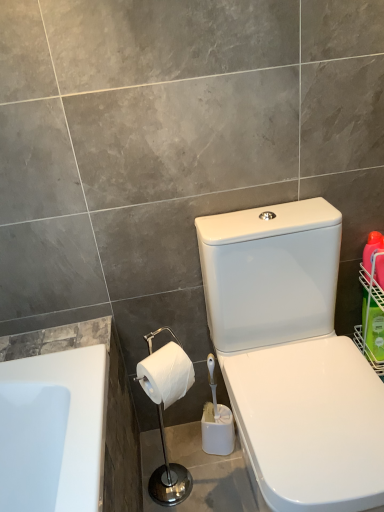
Image resolution: width=384 pixels, height=512 pixels. What are the coordinates of `white glossy toilet at center-right` in the screenshot? It's located at (292, 357).

The image size is (384, 512). Describe the element at coordinates (162, 411) in the screenshot. I see `white glossy toilet paper holder at lower left` at that location.

In order to face white glossy toilet paper holder at lower left, should I rotate leftwards or rightwards?

You should rotate left by 4.100 degrees.

Describe the element at coordinates (372, 249) in the screenshot. I see `bright orange plastic bottle at right` at that location.

Locate an element on the screen. This screenshot has height=512, width=384. white matte toilet paper at lower center is located at coordinates click(166, 374).

Considering the sizes of objects white glossy toilet at center-right and green plastic basket at right in the image provided, who is taller, white glossy toilet at center-right or green plastic basket at right?

white glossy toilet at center-right is taller.

Would you say white glossy toilet at center-right is outside green plastic basket at right?

Indeed, white glossy toilet at center-right is completely outside green plastic basket at right.

Is white glossy toilet at center-right at the left side of green plastic basket at right?

Yes, white glossy toilet at center-right is to the left of green plastic basket at right.

Could you tell me if white glossy toilet at center-right is turned towards green plastic basket at right?

No, white glossy toilet at center-right is not turned towards green plastic basket at right.

Can you confirm if green plastic basket at right is smaller than bright orange plastic bottle at right?

Incorrect, green plastic basket at right is not smaller in size than bright orange plastic bottle at right.

From a real-world perspective, is green plastic basket at right under bright orange plastic bottle at right?

Yes.

Is green plastic basket at right spatially inside bright orange plastic bottle at right, or outside of it?

green plastic basket at right lies outside bright orange plastic bottle at right.

How much distance is there between green plastic basket at right and bright orange plastic bottle at right?

green plastic basket at right is 3.74 inches from bright orange plastic bottle at right.

Considering the relative sizes of bright orange plastic bottle at right and white glossy toilet at center-right in the image provided, is bright orange plastic bottle at right wider than white glossy toilet at center-right?

No.

At what (x,y) coordinates should I click in order to perform the action: click on cleaning product lying above the white glossy toilet at center-right (from the image's perspective). Please return your answer as a coordinate pair (x, y). Image resolution: width=384 pixels, height=512 pixels. Looking at the image, I should click on (372, 249).

What's the angular difference between bright orange plastic bottle at right and white glossy toilet at center-right's facing directions?

bright orange plastic bottle at right and white glossy toilet at center-right are facing 0.0578 degrees away from each other.

From a real-world perspective, is bright orange plastic bottle at right below white glossy toilet at center-right?

Incorrect, from a real-world perspective, bright orange plastic bottle at right is higher than white glossy toilet at center-right.

How much distance is there between bright orange plastic bottle at right and white matte toilet paper at lower center?

bright orange plastic bottle at right and white matte toilet paper at lower center are 25.46 inches apart from each other.

Which object is thinner, bright orange plastic bottle at right or white matte toilet paper at lower center?

Thinner between the two is bright orange plastic bottle at right.

Which is closer to the camera, (371, 262) or (176, 358)?

The point (176, 358) is closer to the camera.

From the image's perspective, is bright orange plastic bottle at right positioned above or below white matte toilet paper at lower center?

bright orange plastic bottle at right is above white matte toilet paper at lower center.

From the image's perspective, between white glossy toilet paper holder at lower left and white glossy toilet at center-right, who is located below?

From the image's view, white glossy toilet paper holder at lower left is below.

Is white glossy toilet paper holder at lower left positioned far away from white glossy toilet at center-right?

Actually, white glossy toilet paper holder at lower left and white glossy toilet at center-right are a little close together.

Is white glossy toilet paper holder at lower left taller than white glossy toilet at center-right?

No.

Is white glossy toilet at center-right located within white glossy toilet paper holder at lower left?

No, white glossy toilet at center-right is located outside of white glossy toilet paper holder at lower left.

Is green plastic basket at right facing away from white matte toilet paper at lower center?

No, white matte toilet paper at lower center is not at the back of green plastic basket at right.

Find the location of a particular element. The image size is (384, 512). toilet paper that is in front of the green plastic basket at right is located at coordinates (166, 374).

Looking at this image, in the image, is green plastic basket at right on the left side or the right side of white matte toilet paper at lower center?

green plastic basket at right is to the right of white matte toilet paper at lower center.

From their relative heights in the image, would you say green plastic basket at right is taller or shorter than white matte toilet paper at lower center?

Clearly, green plastic basket at right is taller compared to white matte toilet paper at lower center.

Is point (170, 347) closer or farther from the camera than point (383, 286)?

Point (170, 347) appears to be closer to the viewer than point (383, 286).

Between white glossy toilet paper holder at lower left and bright orange plastic bottle at right, which one appears on the right side from the viewer's perspective?

bright orange plastic bottle at right.

Can you tell me how much white glossy toilet paper holder at lower left and bright orange plastic bottle at right differ in facing direction?

20.6 degrees.

Could you tell me if white glossy toilet paper holder at lower left is turned towards bright orange plastic bottle at right?

No, white glossy toilet paper holder at lower left is not facing towards bright orange plastic bottle at right.

Locate an element on the screen. Image resolution: width=384 pixels, height=512 pixels. toilet on the left of the green plastic basket at right is located at coordinates (292, 357).

The width and height of the screenshot is (384, 512). I want to click on basket behind the bright orange plastic bottle at right, so click(370, 315).

Looking at this image, from the image, which object appears to be nearer to white matte toilet paper at lower center, bright orange plastic bottle at right or green plastic basket at right?

green plastic basket at right is positioned closer to the anchor white matte toilet paper at lower center.

Estimate the real-world distances between objects in this image. Which object is further from green plastic basket at right, white matte toilet paper at lower center or white glossy toilet at center-right?

Among the two, white matte toilet paper at lower center is located further to green plastic basket at right.

Considering their positions, is white matte toilet paper at lower center positioned closer to white glossy toilet paper holder at lower left than bright orange plastic bottle at right?

white matte toilet paper at lower center is closer to white glossy toilet paper holder at lower left.

Considering their positions, is white glossy toilet at center-right positioned further to green plastic basket at right than bright orange plastic bottle at right?

Among the two, white glossy toilet at center-right is located further to green plastic basket at right.

In the scene shown: Estimate the real-world distances between objects in this image. Which object is further from green plastic basket at right, white glossy toilet paper holder at lower left or white matte toilet paper at lower center?

white glossy toilet paper holder at lower left is further to green plastic basket at right.

From the image, which object appears to be farther from green plastic basket at right, bright orange plastic bottle at right or white matte toilet paper at lower center?

The object further to green plastic basket at right is white matte toilet paper at lower center.

Estimate the real-world distances between objects in this image. Which object is closer to white glossy toilet paper holder at lower left, white matte toilet paper at lower center or green plastic basket at right?

white matte toilet paper at lower center is positioned closer to the anchor white glossy toilet paper holder at lower left.

Looking at the image, which one is located further to bright orange plastic bottle at right, green plastic basket at right or white glossy toilet paper holder at lower left?

Among the two, white glossy toilet paper holder at lower left is located further to bright orange plastic bottle at right.

In order to click on toilet located between white matte toilet paper at lower center and bright orange plastic bottle at right in the left-right direction in this screenshot , I will do (292, 357).

Identify the location of cleaning product located between white matte toilet paper at lower center and green plastic basket at right in the left-right direction. (372, 249).

Identify the location of cleaning product between white glossy toilet at center-right and green plastic basket at right in the front-back direction. (372, 249).

This screenshot has height=512, width=384. I want to click on toilet located between white glossy toilet paper holder at lower left and green plastic basket at right in the left-right direction, so click(x=292, y=357).